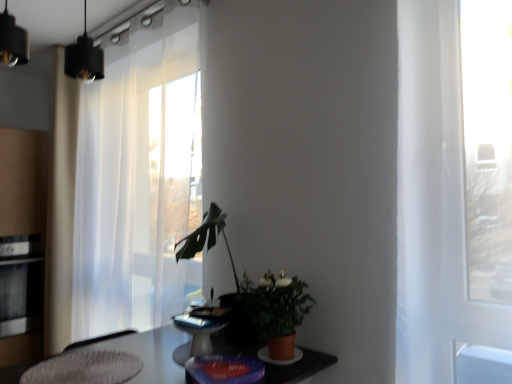
Describe the element at coordinates (138, 179) in the screenshot. I see `white sheer curtain at left` at that location.

The image size is (512, 384). What do you see at coordinates (20, 284) in the screenshot? I see `stainless steel oven at left` at bounding box center [20, 284].

The width and height of the screenshot is (512, 384). Find the location of `stainless steel oven at left`. stainless steel oven at left is located at coordinates (20, 284).

Measure the distance between point (108, 379) and camera.

The depth of point (108, 379) is 1.31 meters.

This screenshot has width=512, height=384. I want to click on textured gray rug at lower left, so (85, 368).

The height and width of the screenshot is (384, 512). Identify the location of green matte plant at center. (267, 324).

Identify the location of white sheer curtain at left. The image size is (512, 384). tap(138, 179).

Measure the distance from white sheer curtain at left to textured gray rug at lower left.

They are 33.92 inches apart.

This screenshot has height=384, width=512. I want to click on curtain behind the textured gray rug at lower left, so click(x=138, y=179).

Is white sheer curtain at left directly adjacent to textured gray rug at lower left?

There is a gap between white sheer curtain at left and textured gray rug at lower left.

In the scene shown: Is white sheer curtain at left inside or outside of textured gray rug at lower left?

white sheer curtain at left is outside textured gray rug at lower left.

Which object is more forward, matte terracotta pot at center or green matte plant at center?

matte terracotta pot at center is closer to the camera.

Identify the location of houseplant behind the matte terracotta pot at center. This screenshot has height=384, width=512. (267, 324).

Does point (272, 285) come closer to viewer compared to point (247, 330)?

No, it is behind (247, 330).

From the image's perspective, between matte terracotta pot at center and green matte plant at center, who is located below?

From the image's view, matte terracotta pot at center is below.

From a real-world perspective, is textured gray rug at lower left physically located above or below white sheer curtain at left?

From a real-world perspective, textured gray rug at lower left is physically below white sheer curtain at left.

Would you say textured gray rug at lower left is a long distance from white sheer curtain at left?

No, textured gray rug at lower left is in close proximity to white sheer curtain at left.

What are the coordinates of `curtain above the textured gray rug at lower left (from the image's perspective)` in the screenshot? It's located at (138, 179).

Would you say textured gray rug at lower left is outside white sheer curtain at left?

textured gray rug at lower left is positioned outside white sheer curtain at left.

Does white sheer curtain at left have a greater height compared to stainless steel oven at left?

Indeed, white sheer curtain at left has a greater height compared to stainless steel oven at left.

Does white sheer curtain at left have a larger size compared to stainless steel oven at left?

Yes, white sheer curtain at left is bigger than stainless steel oven at left.

Is the depth of white sheer curtain at left less than that of stainless steel oven at left?

That is True.

The height and width of the screenshot is (384, 512). I want to click on appliance lying on the left of white sheer curtain at left, so click(x=20, y=284).

Is stainless steel oven at left located outside matte terracotta pot at center?

Yes, stainless steel oven at left is outside of matte terracotta pot at center.

Between point (1, 337) and point (281, 283), which one is positioned behind?

The point (1, 337) is farther from the camera.

Locate an element on the screen. The image size is (512, 384). appliance on the left of matte terracotta pot at center is located at coordinates (20, 284).

From a real-world perspective, who is located higher, stainless steel oven at left or matte terracotta pot at center?

matte terracotta pot at center, from a real-world perspective.

From the image's perspective, which one is positioned lower, stainless steel oven at left or white sheer curtain at left?

stainless steel oven at left is shown below in the image.

Which is closer, [22,255] or [95,111]?

Positioned in front is point [95,111].

How much distance is there between stainless steel oven at left and white sheer curtain at left?

stainless steel oven at left is 30.04 inches away from white sheer curtain at left.

Is stainless steel oven at left facing away from white sheer curtain at left?

No, stainless steel oven at left is not facing away from white sheer curtain at left.

Is green matte plant at center spatially inside stainless steel oven at left, or outside of it?

green matte plant at center is outside stainless steel oven at left.

In the scene shown: From the image's perspective, does green matte plant at center appear higher than stainless steel oven at left?

Yes, from the image's perspective, green matte plant at center is above stainless steel oven at left.

Is green matte plant at center looking in the opposite direction of stainless steel oven at left?

No, green matte plant at center's orientation is not away from stainless steel oven at left.

The width and height of the screenshot is (512, 384). In the image, there is a white sheer curtain at left. What are the coordinates of `swivel chair below it (from the image's perspective)` in the screenshot? It's located at (85, 368).

This screenshot has width=512, height=384. Find the location of `floral arrangement that is under the green matte plant at center (from a real-world perspective)`. floral arrangement that is under the green matte plant at center (from a real-world perspective) is located at coordinates (275, 303).

Which object lies nearer to the anchor point textured gray rug at lower left, matte terracotta pot at center or white sheer curtain at left?

Among the two, matte terracotta pot at center is located nearer to textured gray rug at lower left.

From the image, which object appears to be nearer to stainless steel oven at left, green matte plant at center or matte terracotta pot at center?

green matte plant at center lies closer to stainless steel oven at left than the other object.

Considering their positions, is white sheer curtain at left positioned further to green matte plant at center than stainless steel oven at left?

Among the two, stainless steel oven at left is located further to green matte plant at center.

Based on their spatial positions, is textured gray rug at lower left or white sheer curtain at left closer to green matte plant at center?

The object closer to green matte plant at center is textured gray rug at lower left.

Looking at the image, which one is located further to textured gray rug at lower left, green matte plant at center or white sheer curtain at left?

white sheer curtain at left.

When comparing their distances from textured gray rug at lower left, does white sheer curtain at left or stainless steel oven at left seem further?

stainless steel oven at left is further to textured gray rug at lower left.

Looking at the image, which one is located closer to stainless steel oven at left, matte terracotta pot at center or textured gray rug at lower left?

Based on the image, textured gray rug at lower left appears to be nearer to stainless steel oven at left.

Looking at the image, which one is located closer to stainless steel oven at left, green matte plant at center or white sheer curtain at left?

The object closer to stainless steel oven at left is white sheer curtain at left.

The width and height of the screenshot is (512, 384). In order to click on houseplant located between stainless steel oven at left and matte terracotta pot at center in the left-right direction in this screenshot , I will do `click(267, 324)`.

Find the location of a particular element. This screenshot has width=512, height=384. houseplant situated between white sheer curtain at left and matte terracotta pot at center from left to right is located at coordinates (267, 324).

Image resolution: width=512 pixels, height=384 pixels. I want to click on houseplant situated between textured gray rug at lower left and matte terracotta pot at center from left to right, so click(x=267, y=324).

Find the location of a particular element. This screenshot has height=384, width=512. houseplant located between textured gray rug at lower left and white sheer curtain at left in the depth direction is located at coordinates (267, 324).